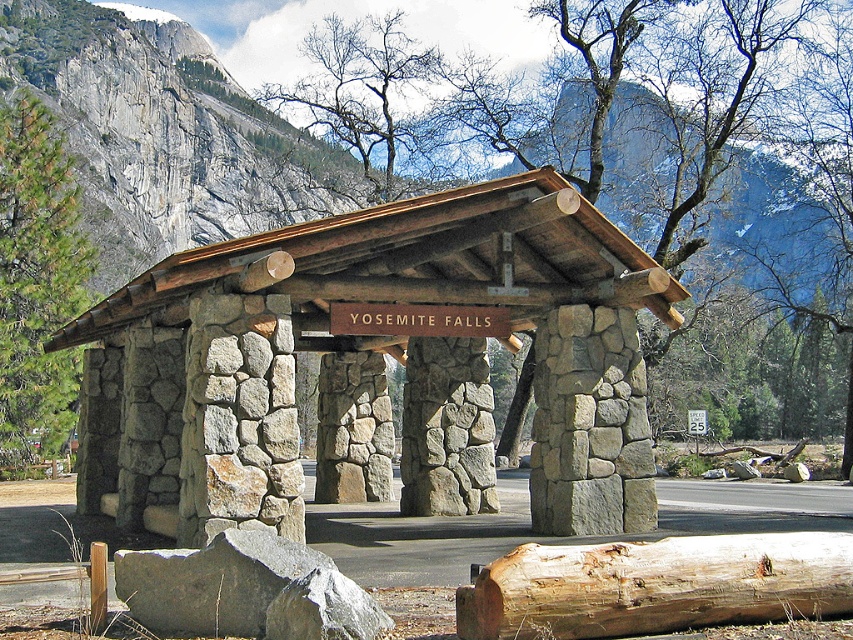
Question: Which object is farther from the camera taking this photo?

Choices:
 (A) stone/rough wood hut at center
 (B) light brown wood log at center
 (C) bare branches at upper center

Answer: (C)

Question: Is stone/rough wood hut at center positioned behind green pine tree at left?

Choices:
 (A) yes
 (B) no

Answer: (B)

Question: Which point is farther from the camera taking this photo?

Choices:
 (A) (524, 220)
 (B) (379, 29)
 (C) (73, 221)
 (D) (744, 620)

Answer: (B)

Question: Does green pine tree at left have a greater width compared to bare branches at upper center?

Choices:
 (A) yes
 (B) no

Answer: (B)

Question: Can you confirm if light brown wood log at center is positioned to the left of green pine tree at left?

Choices:
 (A) no
 (B) yes

Answer: (A)

Question: Based on their relative distances, which object is farther from the bare branches at upper center?

Choices:
 (A) stone/rough wood hut at center
 (B) light brown wood log at center
 (C) green pine tree at left

Answer: (B)